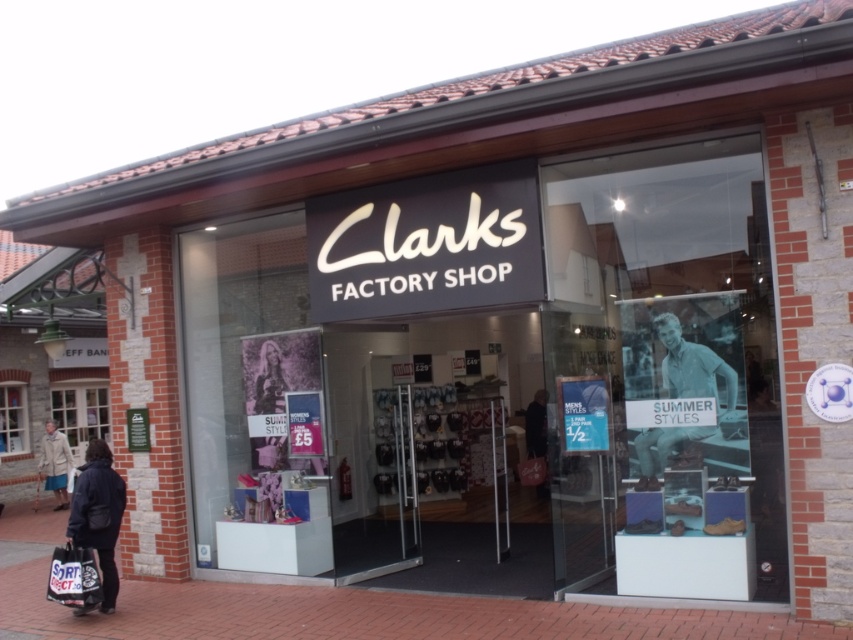
Can you confirm if brick pavement at lower center is smaller than dark blue coat at lower left?

Correct, brick pavement at lower center occupies less space than dark blue coat at lower left.

Can you confirm if brick pavement at lower center is positioned below dark blue coat at lower left?

Indeed, brick pavement at lower center is positioned under dark blue coat at lower left.

You are a GUI agent. You are given a task and a screenshot of the screen. Output one action in this format:
    pyautogui.click(x=<x>, y=<y>)
    Task: Click on the brick pavement at lower center
    The image size is (853, 640).
    Given the screenshot: What is the action you would take?
    pyautogui.click(x=351, y=612)

Does point (9, 545) come in front of point (49, 586)?

That is False.

Does brick pavement at lower center appear on the right side of matte black shopping bag at lower left?

Indeed, brick pavement at lower center is positioned on the right side of matte black shopping bag at lower left.

Does point (412, 620) lie in front of point (54, 579)?

Yes.

This screenshot has height=640, width=853. Find the location of `brick pavement at lower center`. brick pavement at lower center is located at coordinates (351, 612).

Does brick pavement at lower center have a greater width compared to light blue denim jeans at center?

Incorrect, brick pavement at lower center's width does not surpass light blue denim jeans at center's.

Is brick pavement at lower center to the left of light blue denim jeans at center from the viewer's perspective?

No, brick pavement at lower center is not to the left of light blue denim jeans at center.

I want to click on brick pavement at lower center, so click(x=351, y=612).